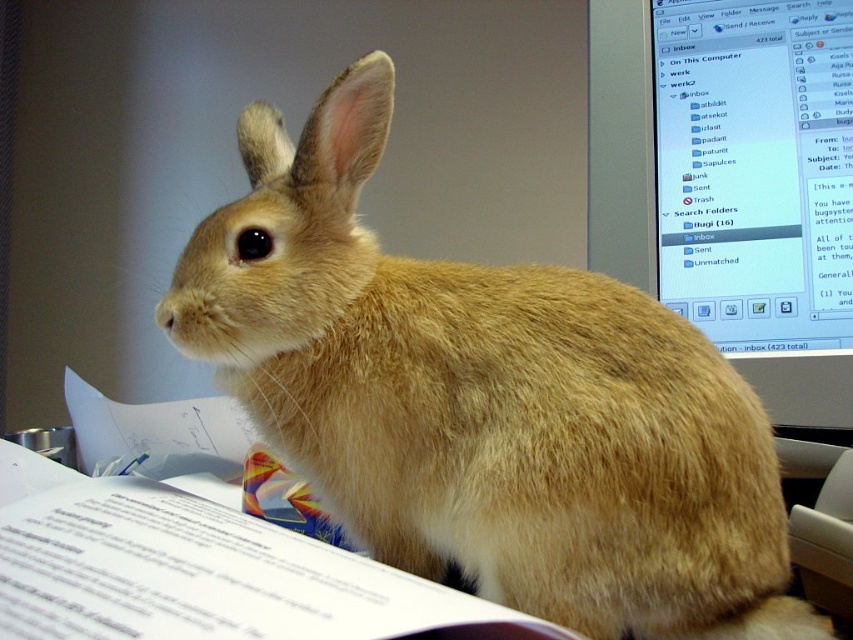
You are organizing your desk and need to move the furry beige rabbit at center and the matte plastic monitor at upper right. Which object is positioned lower on the desk?

The furry beige rabbit at center is located below the matte plastic monitor at upper right, so it is positioned lower on the desk.